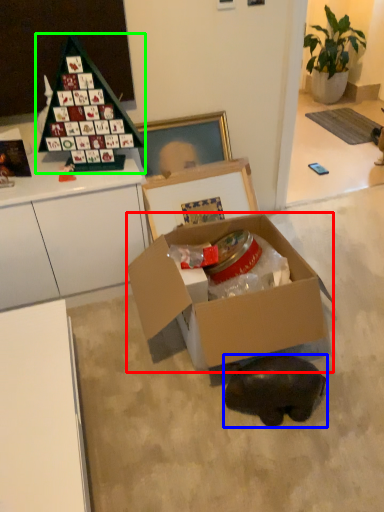
Question: Estimate the real-world distances between objects in this image. Which object is farther from box (highlighted by a red box), animal (highlighted by a blue box) or toy (highlighted by a green box)?

Choices:
 (A) animal
 (B) toy

Answer: (B)